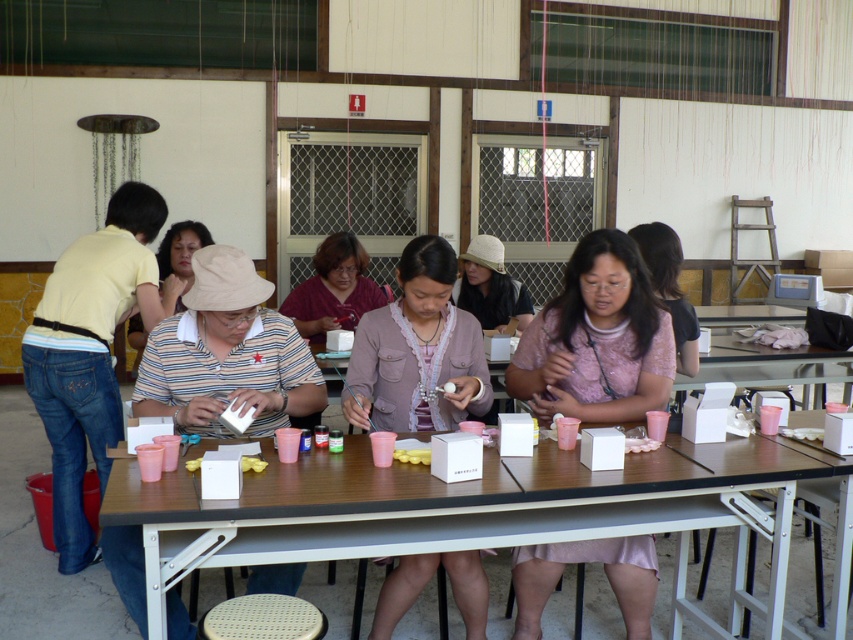
Question: Can you confirm if wooden table at center is thinner than matte white hat at center?

Choices:
 (A) yes
 (B) no

Answer: (B)

Question: Which point is farther to the camera?

Choices:
 (A) white woven stool at lower center
 (B) yellow matte sponge at table center
 (C) pink fabric shirt at center
 (D) pink satin dress at center

Answer: (D)

Question: Is white woven stool at lower center smaller than yellow matte sponge at table center?

Choices:
 (A) no
 (B) yes

Answer: (A)

Question: Does pink satin dress at center have a smaller size compared to pink fabric shirt at center?

Choices:
 (A) no
 (B) yes

Answer: (B)

Question: Which of the following is the farthest from the observer?

Choices:
 (A) yellow matte sponge at table center
 (B) pink satin dress at center
 (C) matte white hat at center
 (D) white woven stool at lower center

Answer: (C)

Question: Which of these objects is positioned closest to the matte white hat at center?

Choices:
 (A) wooden table at center
 (B) white woven stool at lower center
 (C) pink satin dress at center
 (D) yellow matte sponge at table center

Answer: (D)